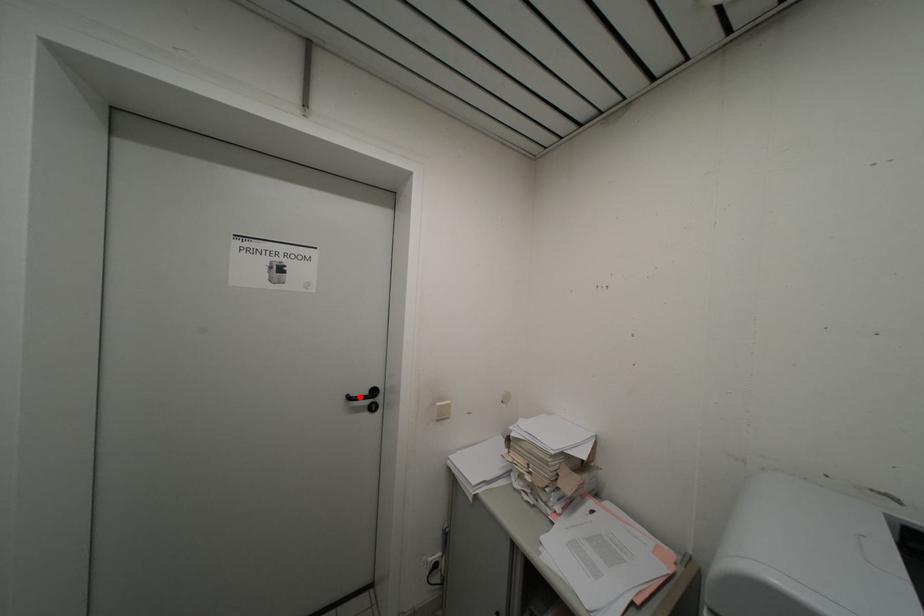
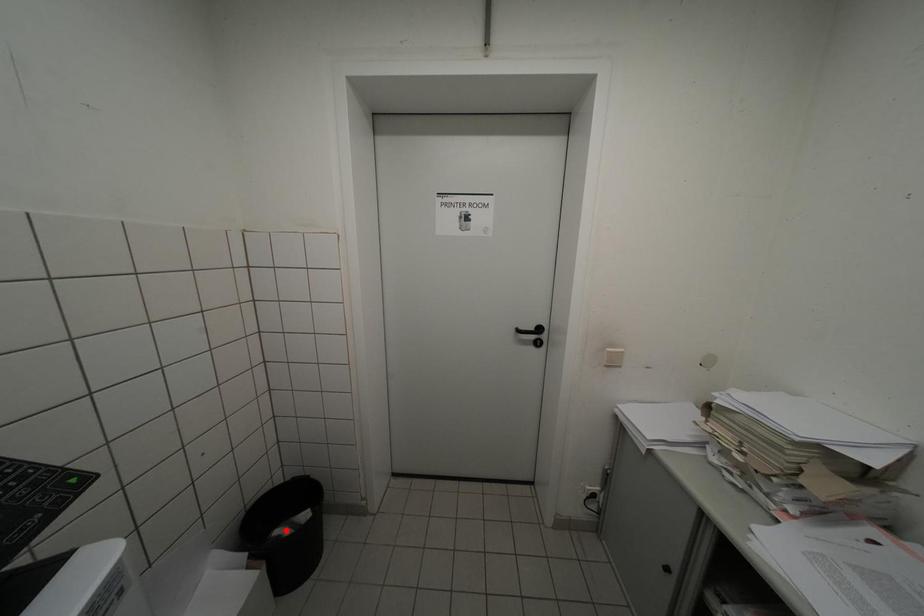
I am providing you with two images of the same scene from different viewpoints. A red point is marked on the first image and another point is marked on the second image. Do the highlighted points in image1 and image2 indicate the same real-world spot?

No